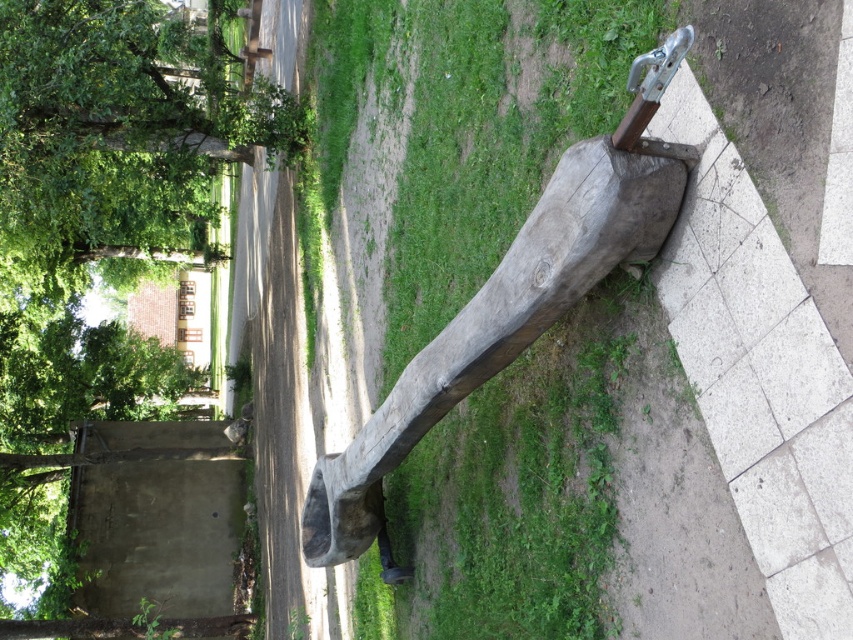
Describe the element at coordinates (113, 136) in the screenshot. I see `green leafy tree at upper left` at that location.

Measure the distance between point (96, 28) and camera.

8.70 meters

Locate an element on the screen. This screenshot has height=640, width=853. green leafy tree at upper left is located at coordinates (113, 136).